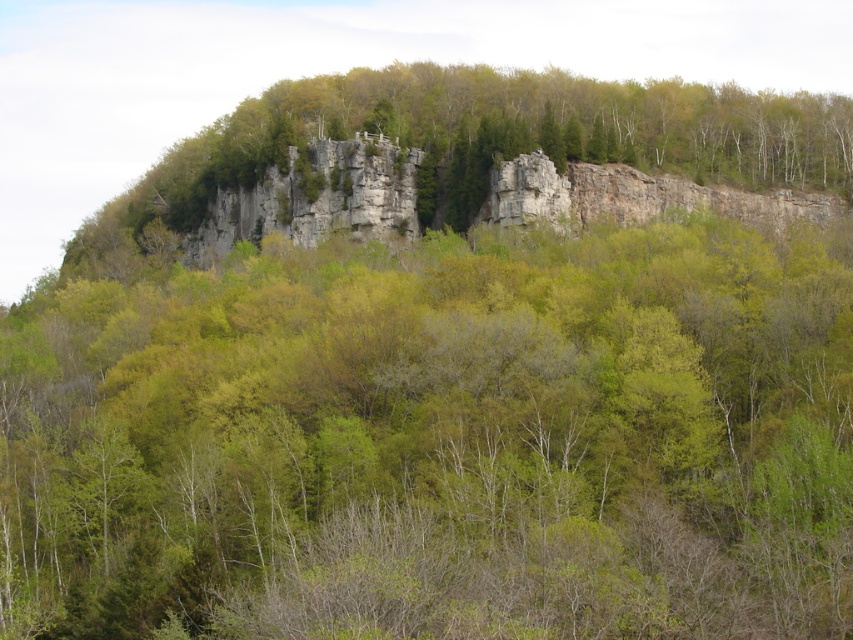
You are a hiker standing at the base of the rocky outcrop and want to reach the green leafy tree at upper center. There is a green leafy tree at center blocking your path. Can you walk straight towards the upper tree without going around the lower tree?

The green leafy tree at upper center and green leafy tree at center are 46.55 meters apart from each other, so there is enough space between them for you to walk straight towards the upper tree without needing to go around the lower tree.

You are a hiker standing at the base of the rocky outcrop. You notice two green leafy trees in the scene. Which tree, the green leafy tree at upper center or the green leafy tree at center, is taller?

The green leafy tree at center is taller than the green leafy tree at upper center.